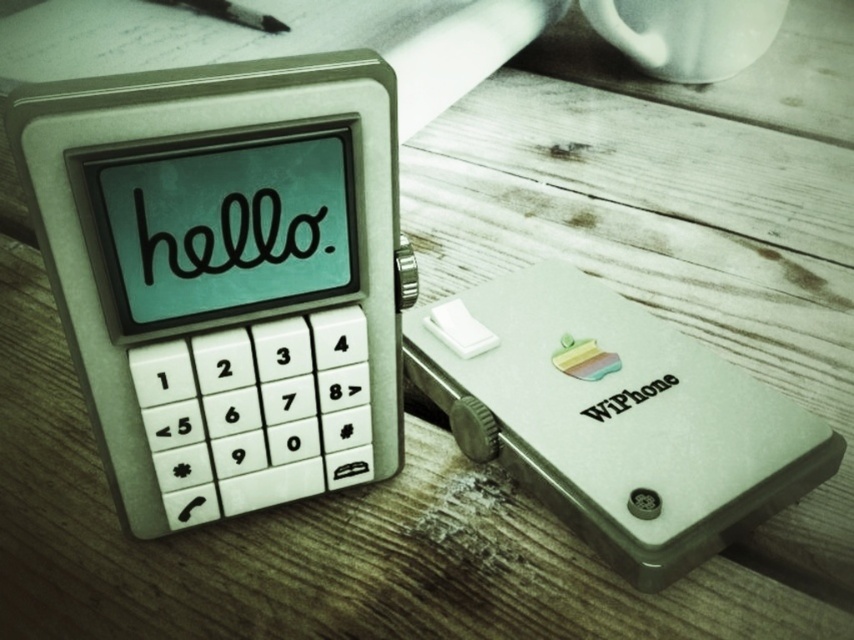
Question: Which object is the farthest from the matte white phone at center?

Choices:
 (A) brushed metal pen at upper left
 (B) white ceramic mug at upper center

Answer: (B)

Question: Which of the following is the farthest from the observer?

Choices:
 (A) white ceramic mug at upper center
 (B) brushed metal pen at upper left
 (C) matte white phone at center

Answer: (B)

Question: Is white ceramic mug at upper center above brushed metal pen at upper left?

Choices:
 (A) yes
 (B) no

Answer: (B)

Question: Is matte white phone at center positioned at the back of white ceramic mug at upper center?

Choices:
 (A) yes
 (B) no

Answer: (B)

Question: Observing the image, what is the correct spatial positioning of matte white phone at center in reference to brushed metal pen at upper left?

Choices:
 (A) above
 (B) below

Answer: (B)

Question: Considering the real-world distances, which object is closest to the white ceramic mug at upper center?

Choices:
 (A) brushed metal pen at upper left
 (B) matte white phone at center

Answer: (A)